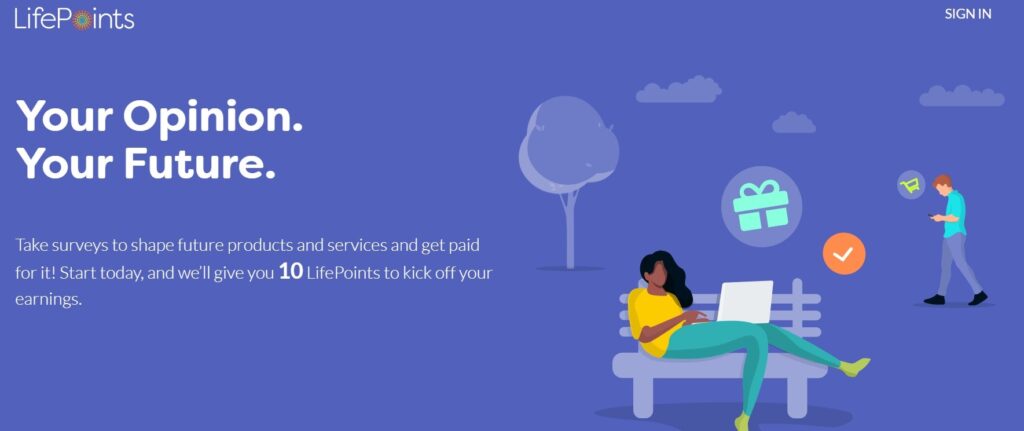
Where is `bench`? bench is located at coordinates (647, 373).